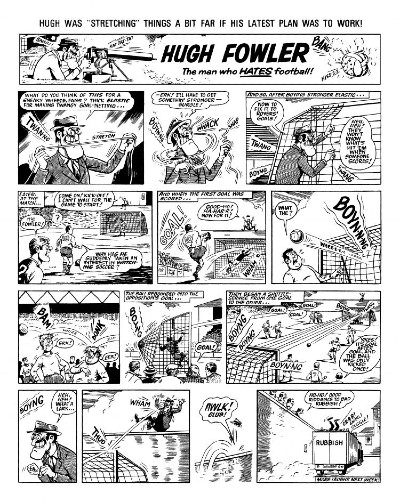
Identify the location of wall. The height and width of the screenshot is (502, 400). (281, 428).